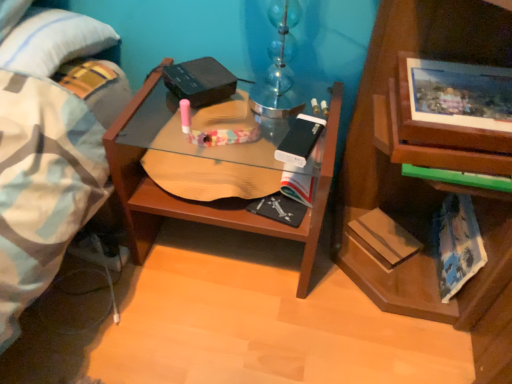
Find the location of a particular element. The image size is (512, 384). free spot to the left of blue tie-dye paperback book at lower right, which appears as the 1th paperback book when viewed from the right is located at coordinates pyautogui.click(x=350, y=281).